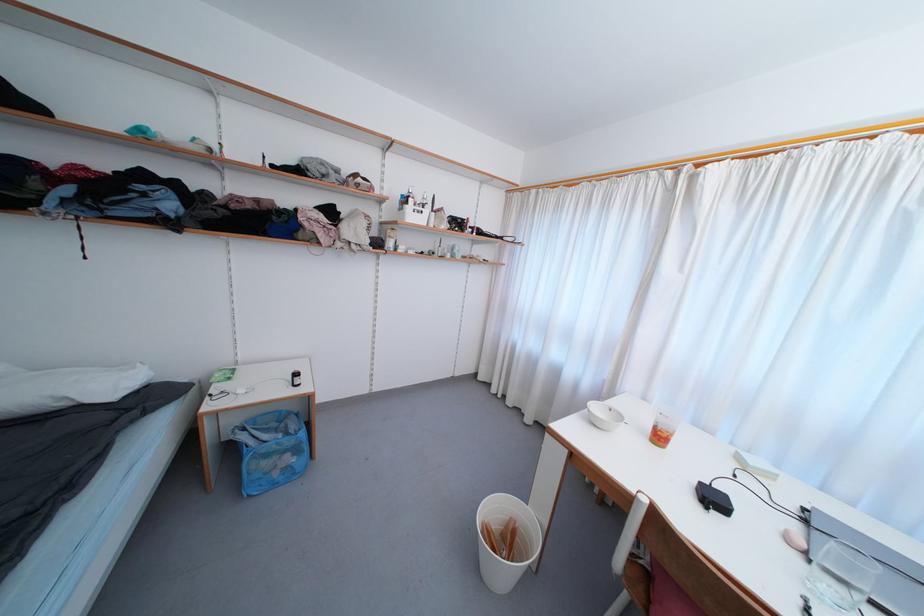
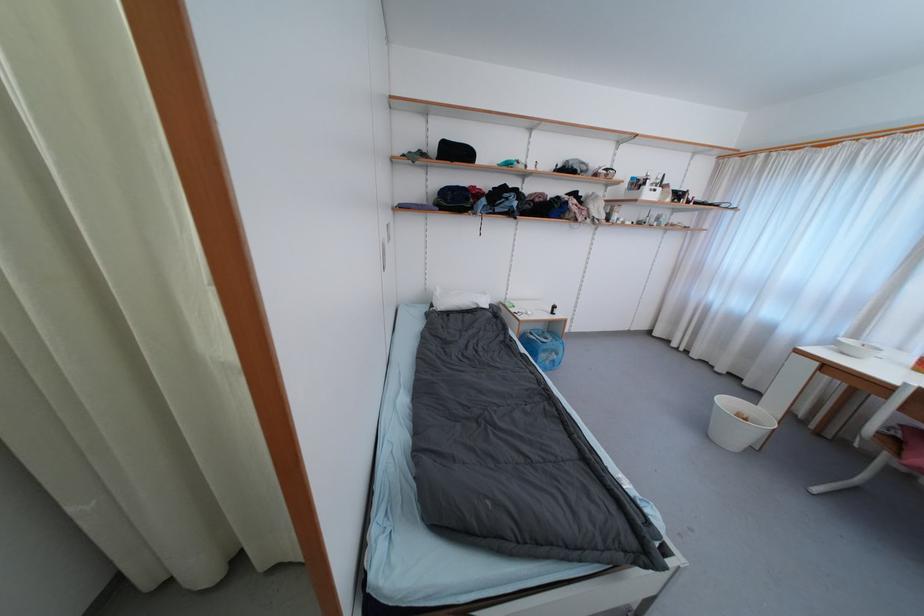
Find the pixel in the second image that matches [247,431] in the first image.

(535, 336)